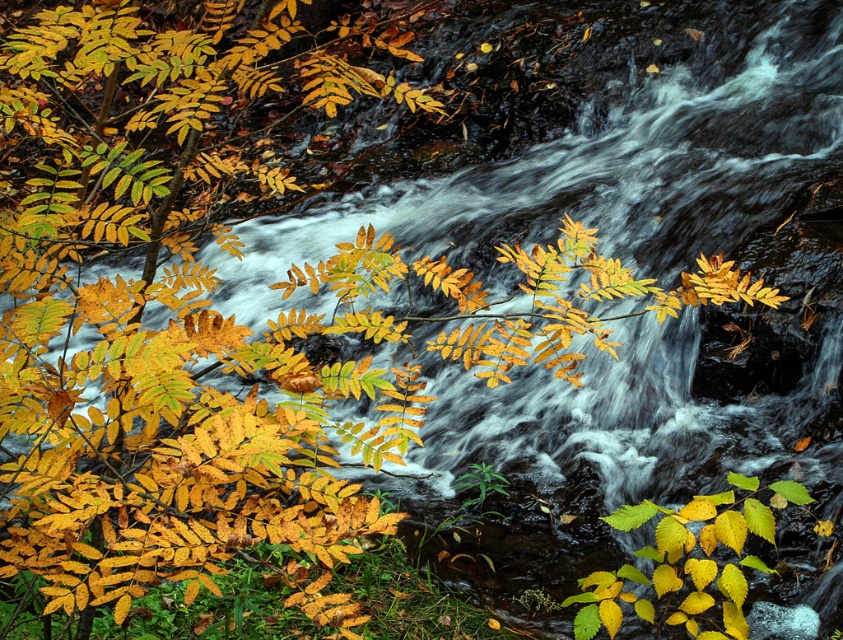
Question: Is green glossy leaf at lower center above yellow matte leaf at lower right?

Choices:
 (A) no
 (B) yes

Answer: (A)

Question: Estimate the real-world distances between objects in this image. Which object is closer to the yellow matte leaf at lower right?

Choices:
 (A) green glossy leaf at lower center
 (B) yellow matte leaf at center

Answer: (B)

Question: Can you confirm if green glossy leaf at lower center is wider than yellow matte leaf at lower right?

Choices:
 (A) yes
 (B) no

Answer: (B)

Question: Among these points, which one is nearest to the camera?

Choices:
 (A) (801, 484)
 (B) (750, 508)

Answer: (B)

Question: Which point is closer to the camera?

Choices:
 (A) (807, 497)
 (B) (631, 520)
 (C) (771, 540)

Answer: (A)

Question: Considering the relative positions of yellow matte leaf at center and green glossy leaf at lower center in the image provided, where is yellow matte leaf at center located with respect to green glossy leaf at lower center?

Choices:
 (A) above
 (B) below

Answer: (B)